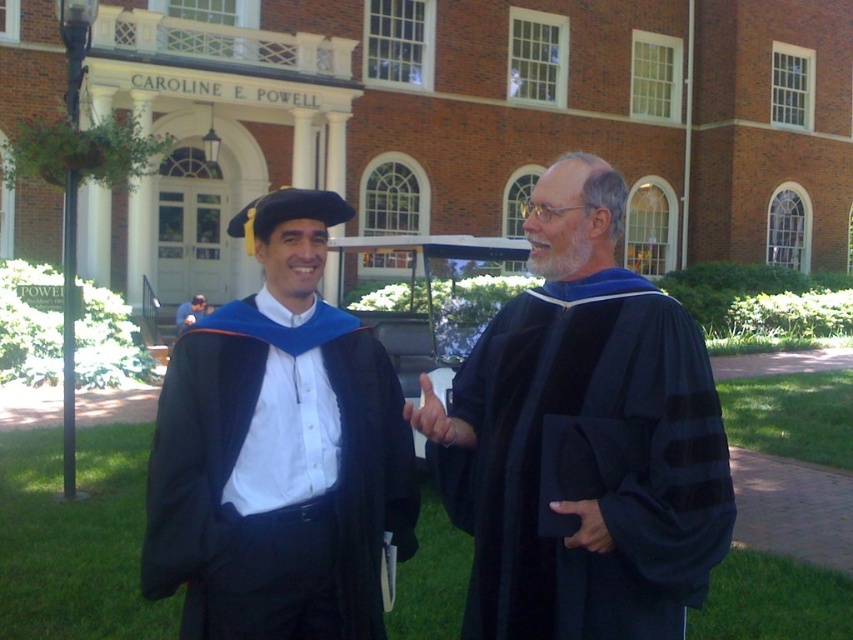
Question: Considering the relative positions of black matte graduation gown at center and matte black robe at center in the image provided, where is black matte graduation gown at center located with respect to matte black robe at center?

Choices:
 (A) left
 (B) right

Answer: (B)

Question: Which point is farther to the camera?

Choices:
 (A) (178, 403)
 (B) (646, 317)

Answer: (A)

Question: Is black matte graduation gown at center positioned behind matte black robe at center?

Choices:
 (A) no
 (B) yes

Answer: (A)

Question: Observing the image, what is the correct spatial positioning of black matte graduation gown at center in reference to matte black robe at center?

Choices:
 (A) right
 (B) left

Answer: (A)

Question: Which of the following is the farthest from the observer?

Choices:
 (A) black matte graduation gown at center
 (B) matte black robe at center

Answer: (B)